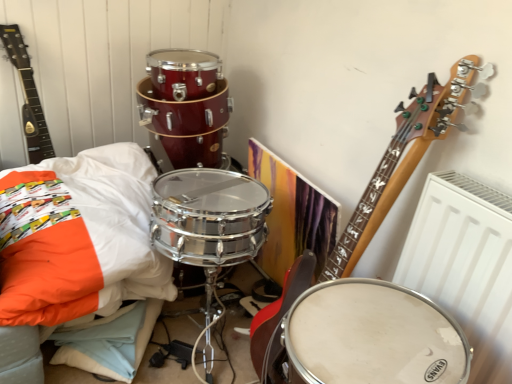
Question: Can you confirm if white soft pillow at lower left is positioned to the left of matte black guitar at upper left?

Choices:
 (A) no
 (B) yes

Answer: (A)

Question: Considering the relative sizes of white soft pillow at lower left and matte black guitar at upper left in the image provided, is white soft pillow at lower left smaller than matte black guitar at upper left?

Choices:
 (A) no
 (B) yes

Answer: (A)

Question: Considering the relative sizes of white soft pillow at lower left and matte black guitar at upper left in the image provided, is white soft pillow at lower left wider than matte black guitar at upper left?

Choices:
 (A) no
 (B) yes

Answer: (B)

Question: Can you confirm if white soft pillow at lower left is bigger than matte black guitar at upper left?

Choices:
 (A) no
 (B) yes

Answer: (B)

Question: Can you confirm if white soft pillow at lower left is thinner than matte black guitar at upper left?

Choices:
 (A) yes
 (B) no

Answer: (B)

Question: From a real-world perspective, is white soft pillow at lower left positioned under matte black guitar at upper left based on gravity?

Choices:
 (A) no
 (B) yes

Answer: (B)

Question: Can you confirm if matte black guitar at upper left is shorter than white soft pillow at lower left?

Choices:
 (A) yes
 (B) no

Answer: (B)

Question: Is matte black guitar at upper left at the left side of white soft pillow at lower left?

Choices:
 (A) no
 (B) yes

Answer: (B)

Question: Does matte black guitar at upper left have a lesser width compared to white soft pillow at lower left?

Choices:
 (A) yes
 (B) no

Answer: (A)

Question: Is matte black guitar at upper left not close to white soft pillow at lower left?

Choices:
 (A) yes
 (B) no

Answer: (B)

Question: Does matte black guitar at upper left have a greater height compared to white soft pillow at lower left?

Choices:
 (A) no
 (B) yes

Answer: (B)

Question: Is matte black guitar at upper left in front of white soft pillow at lower left?

Choices:
 (A) no
 (B) yes

Answer: (A)

Question: Does white matte drum at center appear on the left side of white soft pillow at lower left?

Choices:
 (A) yes
 (B) no

Answer: (B)